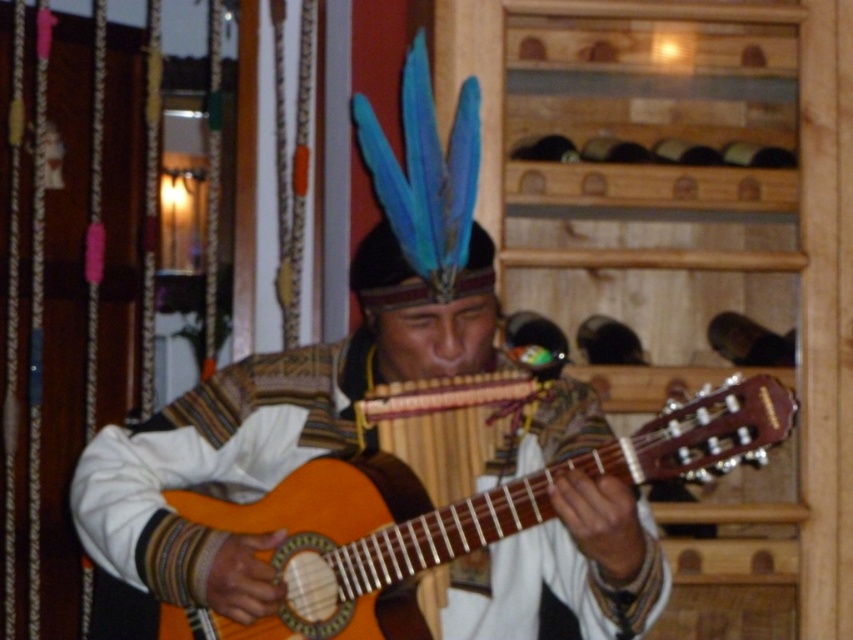
Question: Which point is farther to the camera?

Choices:
 (A) wooden acoustic guitar at center
 (B) wooden guitar at center

Answer: (B)

Question: Which of the following is the closest to the observer?

Choices:
 (A) (105, 432)
 (B) (576, 460)

Answer: (B)

Question: Can you confirm if wooden guitar at center is thinner than wooden acoustic guitar at center?

Choices:
 (A) yes
 (B) no

Answer: (B)

Question: Considering the relative positions of wooden guitar at center and wooden acoustic guitar at center in the image provided, where is wooden guitar at center located with respect to wooden acoustic guitar at center?

Choices:
 (A) left
 (B) right

Answer: (A)

Question: Can you confirm if wooden guitar at center is thinner than wooden acoustic guitar at center?

Choices:
 (A) yes
 (B) no

Answer: (B)